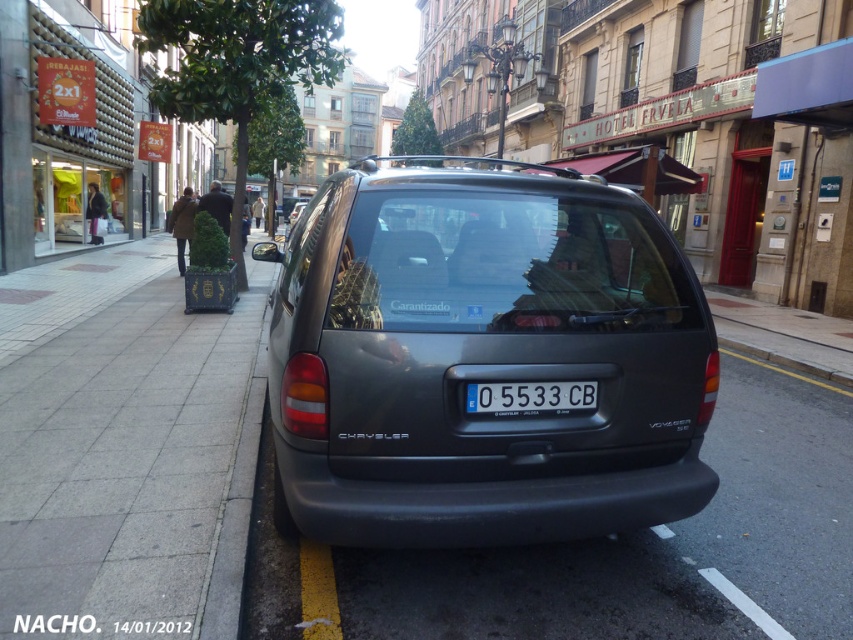
Is white plastic license plate at center wider than satin black van at center?

No.

Between white plastic license plate at center and satin black van at center, which one is positioned lower?

white plastic license plate at center is below.

The width and height of the screenshot is (853, 640). Identify the location of white plastic license plate at center. (531, 397).

Is point (212, 600) more distant than point (488, 404)?

That is True.

Can you confirm if gray concrete curb at lower left is positioned below white plastic license plate at center?

Actually, gray concrete curb at lower left is above white plastic license plate at center.

Which is behind, point (251, 275) or point (578, 401)?

The point (251, 275) is more distant.

You are a GUI agent. You are given a task and a screenshot of the screen. Output one action in this format:
    pyautogui.click(x=<x>, y=<y>)
    Task: Click on the gray concrete curb at lower left
    This screenshot has height=640, width=853.
    Given the screenshot: What is the action you would take?
    pyautogui.click(x=236, y=476)

Does gray concrete pavement at lower left have a lesser height compared to white plastic license plate at center?

No.

Between gray concrete pavement at lower left and white plastic license plate at center, which one has more height?

gray concrete pavement at lower left is taller.

Is point (173, 502) closer to viewer compared to point (491, 410)?

No, (173, 502) is further to viewer.

Where is `gray concrete pavement at lower left`? This screenshot has height=640, width=853. gray concrete pavement at lower left is located at coordinates (125, 449).